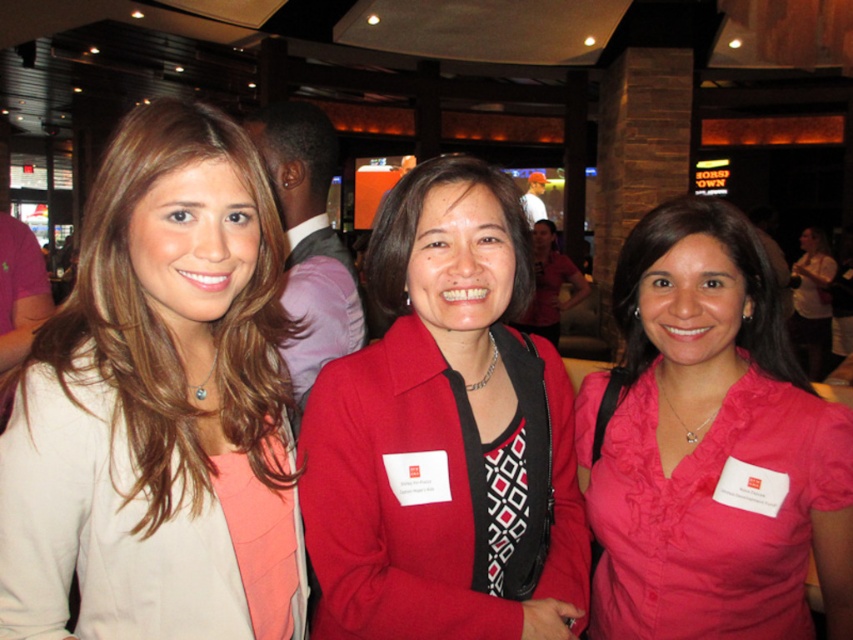
Looking at this image, you are a photographer at the event and need to ensure all clothing items are visible in the photo. The matte red blazer at center and the pink fabric shirt at right are partially obscured. Which clothing item requires more adjustment to fully show since it is larger?

The pink fabric shirt at right requires more adjustment to fully show since it is larger than the matte red blazer at center.

You are a photographer at the event and want to capture a photo of the two women wearing the matte red blazer at center and the pink satin blouse at center. Since you want them to appear side by side in the frame, which one should you position to the left to maintain their current spatial relationship?

The matte red blazer at center should be positioned to the left of the pink satin blouse at center to maintain their current spatial relationship.

You are a photographer at the event and need to adjust the camera focus. The matte beige blazer at left and the pink fabric shirt at right are both in the frame. Which one is shorter in height?

The matte beige blazer at left is not as tall as the pink fabric shirt at right, so the matte beige blazer at left is shorter in height.